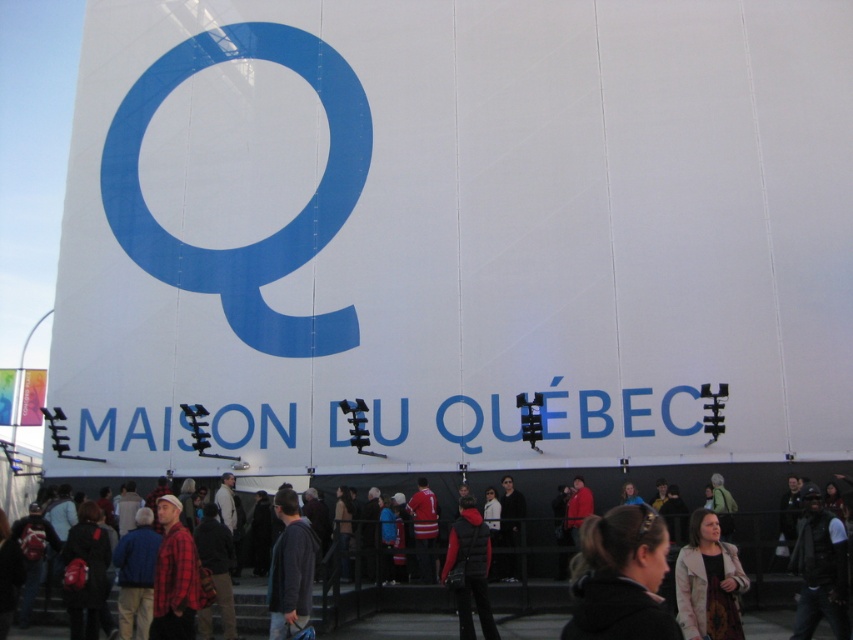
Question: Among these points, which one is nearest to the camera?

Choices:
 (A) (451, 524)
 (B) (320, 596)
 (C) (817, 596)
 (D) (602, 531)

Answer: (D)

Question: Can you confirm if blue matte sign at center is smaller than black matte jacket at lower center?

Choices:
 (A) yes
 (B) no

Answer: (B)

Question: Among these objects, which one is farthest from the camera?

Choices:
 (A) red fleece jacket at center
 (B) dark blue leather jacket at lower right
 (C) blue matte sign at center

Answer: (C)

Question: Can you confirm if red plaid shirt at lower left is positioned to the left of red fleece jacket at center?

Choices:
 (A) no
 (B) yes

Answer: (B)

Question: Considering the real-world distances, which object is closest to the red fleece jacket at center?

Choices:
 (A) dark gray sweater at center
 (B) blue matte sign at center

Answer: (A)

Question: Can you confirm if blue matte sign at center is positioned to the right of black matte jacket at lower center?

Choices:
 (A) no
 (B) yes

Answer: (A)